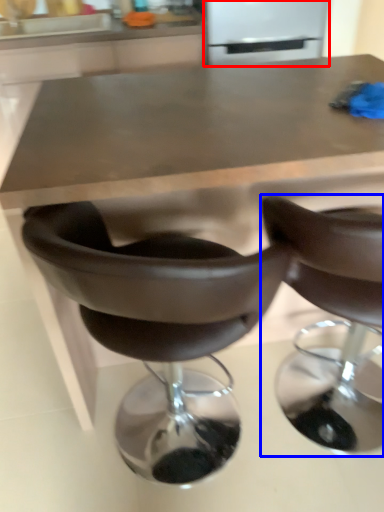
Question: Among these objects, which one is nearest to the camera, appliance (highlighted by a red box) or chair (highlighted by a blue box)?

Choices:
 (A) appliance
 (B) chair

Answer: (B)